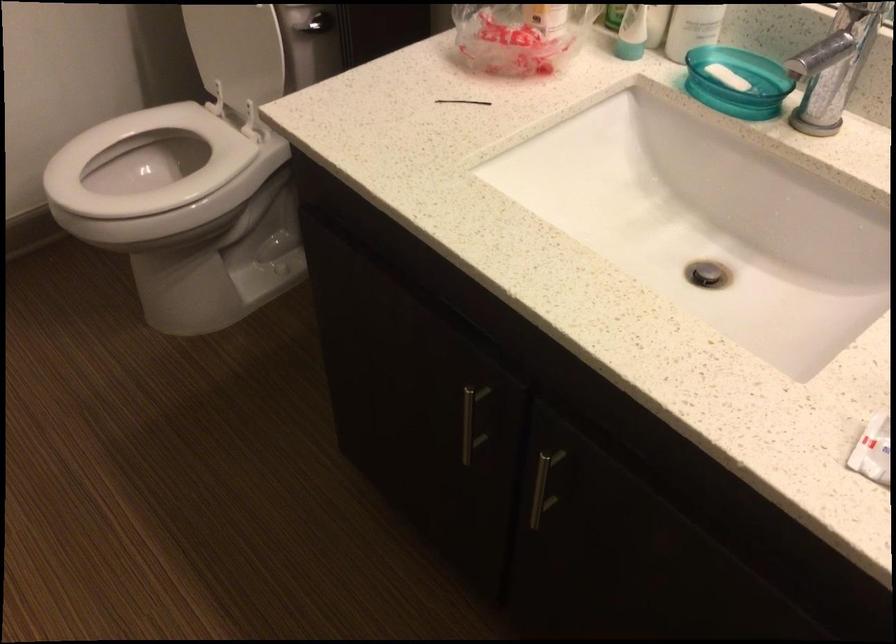
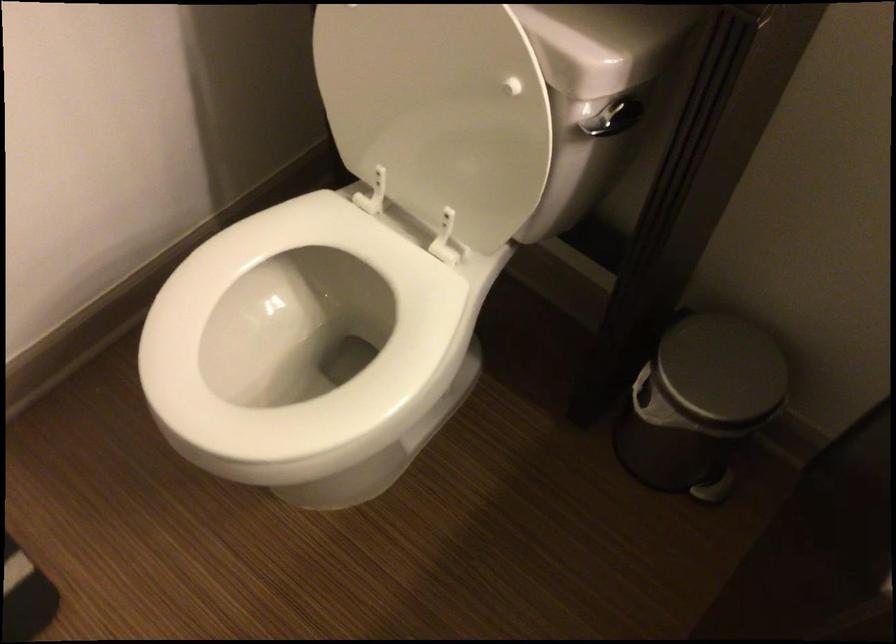
In a continuous first-person perspective shot, in which direction is the camera moving?

The cameraman walked toward left, forward.